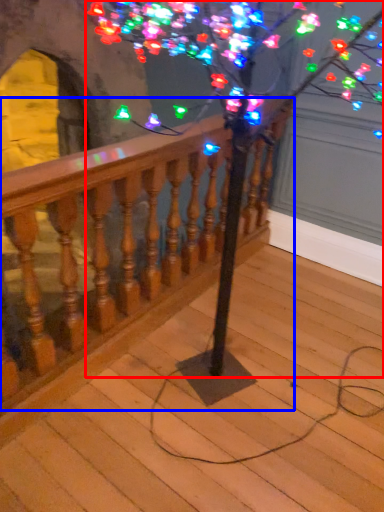
Question: Which of the following is the farthest to the observer, tree (highlighted by a red box) or rail (highlighted by a blue box)?

Choices:
 (A) tree
 (B) rail

Answer: (B)